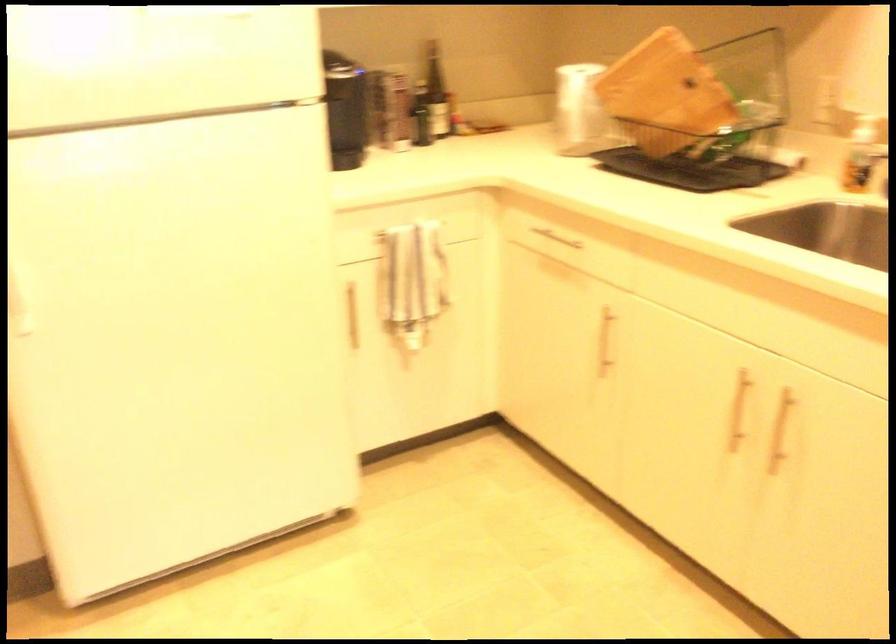
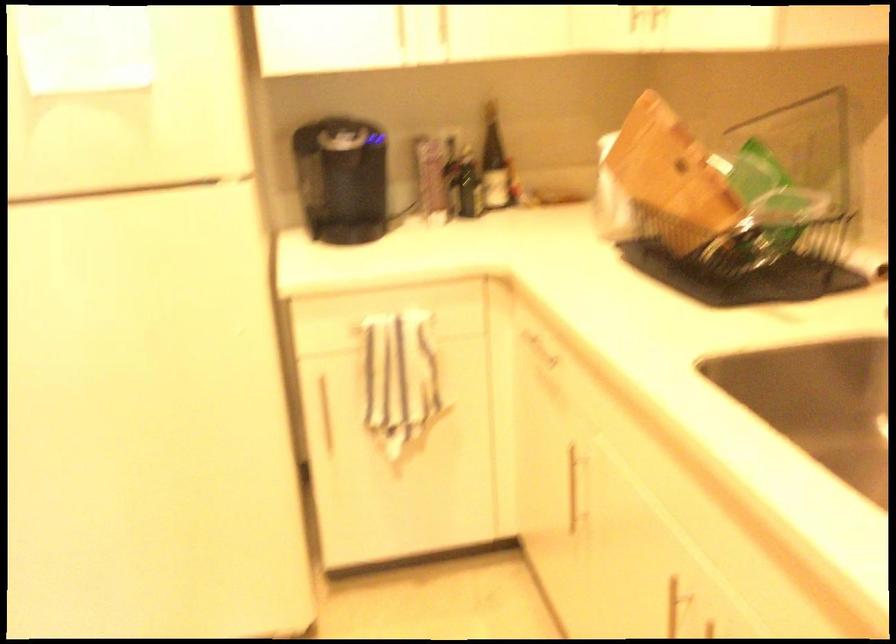
Question: I am providing you with two images of the same scene from different viewpoints. Please identify which objects are invisible in image2.

Choices:
 (A) white paper towel roll
 (B) fan control hub
 (C) cabinet towel bar
 (D) silver cabinet handle

Answer: (A)